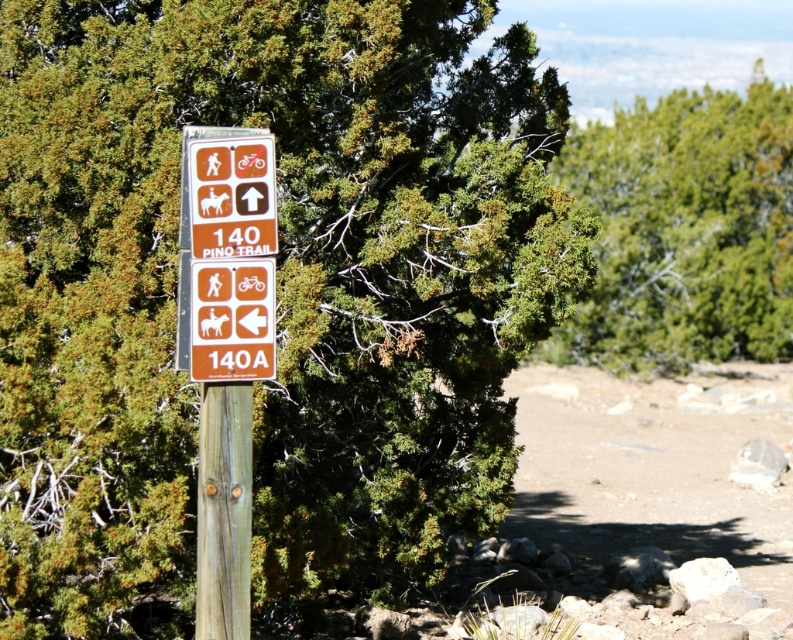
You are a hiker trying to locate the trailhead for the Pino Trail. You see the wooden signpost with two rectangular signs stacked vertically and a green leafy tree at upper center. Based on the coordinates provided, is the tree closer to the top or bottom sign?

The green leafy tree at upper center is positioned at point (684, 230). Since the top sign is higher up on the signpost, the tree is closer to the top sign.

You are a hiker trying to read both the brown wood post at center and the orange matte sign at center. Which one is positioned higher up?

The orange matte sign at center is positioned higher up because the brown wood post at center is below it.